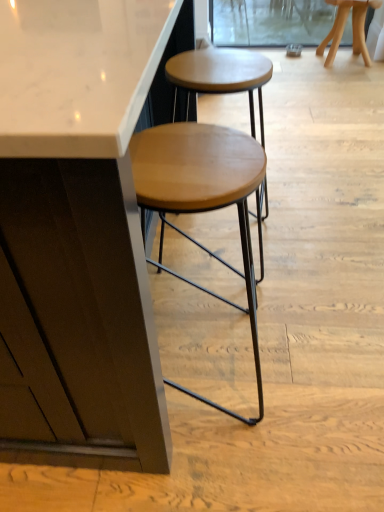
Where is `free space in front of wooden seat at center, the second stool in the right-to-left sequence`? Image resolution: width=384 pixels, height=512 pixels. free space in front of wooden seat at center, the second stool in the right-to-left sequence is located at coordinates (212, 465).